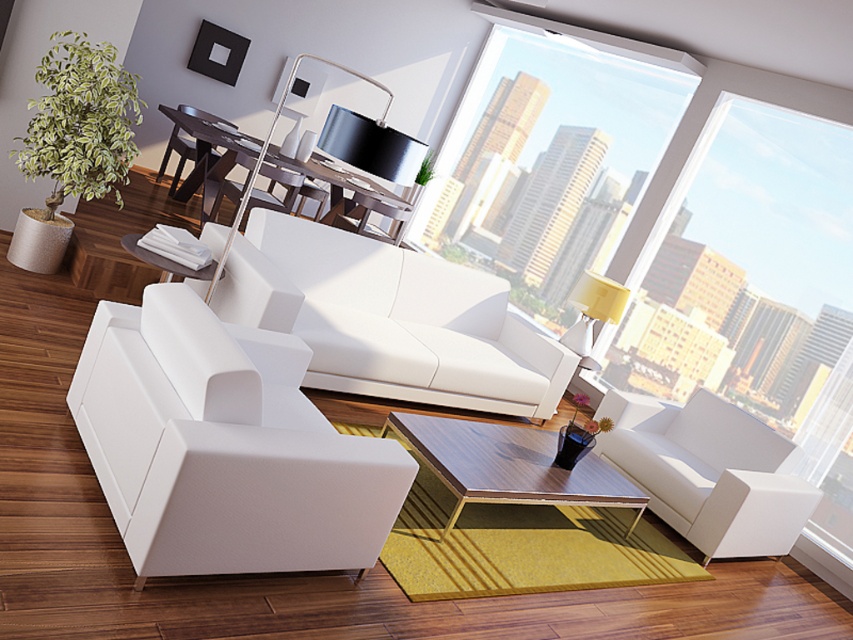
Question: Which object is closer to the camera taking this photo?

Choices:
 (A) white leather couch at center
 (B) transparent glass window at center
 (C) matte white table at center

Answer: (A)

Question: Estimate the real-world distances between objects in this image. Which object is closer to the white leather armchair at lower left?

Choices:
 (A) transparent glass window at center
 (B) white leather couch at center
 (C) white leather armchair at lower right

Answer: (B)

Question: Among these points, which one is nearest to the camera?

Choices:
 (A) (218, 141)
 (B) (555, 364)
 (C) (784, 154)

Answer: (B)

Question: Is white leather armchair at lower right to the left of wooden/metallic coffee table at center from the viewer's perspective?

Choices:
 (A) no
 (B) yes

Answer: (A)

Question: Does white leather armchair at lower right appear under matte white table at center?

Choices:
 (A) yes
 (B) no

Answer: (A)

Question: Is white leather armchair at lower left above wooden/metallic coffee table at center?

Choices:
 (A) yes
 (B) no

Answer: (A)